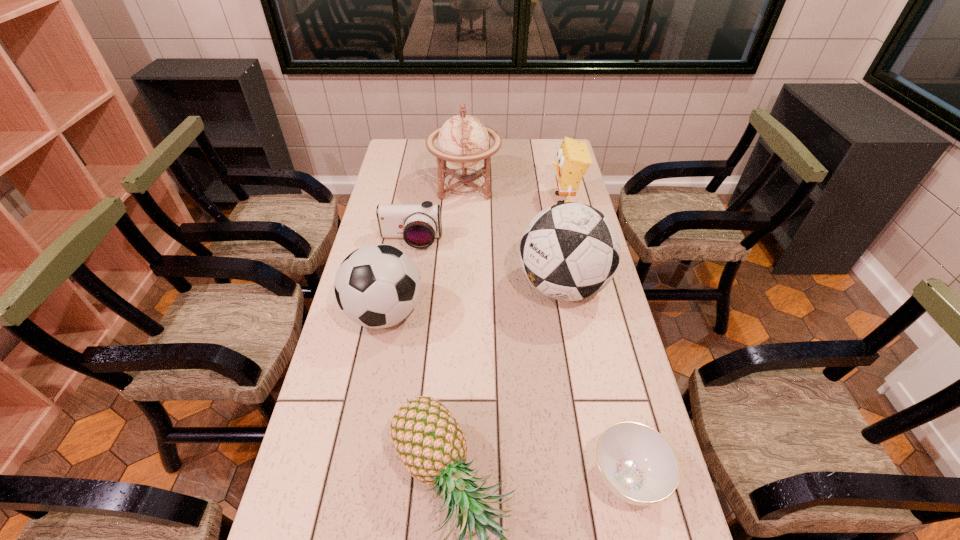
The height and width of the screenshot is (540, 960). Find the location of `globe`. globe is located at coordinates (463, 140).

This screenshot has height=540, width=960. I want to click on the taller soccer ball, so click(570, 251).

Find the location of `the second tallest object`. the second tallest object is located at coordinates click(x=570, y=251).

Find the location of a particular element. the shorter soccer ball is located at coordinates (377, 286).

This screenshot has height=540, width=960. Identify the location of sponge. (573, 159).

Where is `the second shortest object`? This screenshot has width=960, height=540. the second shortest object is located at coordinates (419, 225).

This screenshot has width=960, height=540. I want to click on camcorder, so click(419, 225).

Identify the location of the shortest object. The image size is (960, 540). (637, 464).

Identify the location of vacant region located 0.260m on the front-facing side of the globe. The width and height of the screenshot is (960, 540). (564, 185).

Identify the location of blank space located 0.310m on the surface of the sixth shortest object where the brand logo is visible. This screenshot has width=960, height=540. (420, 286).